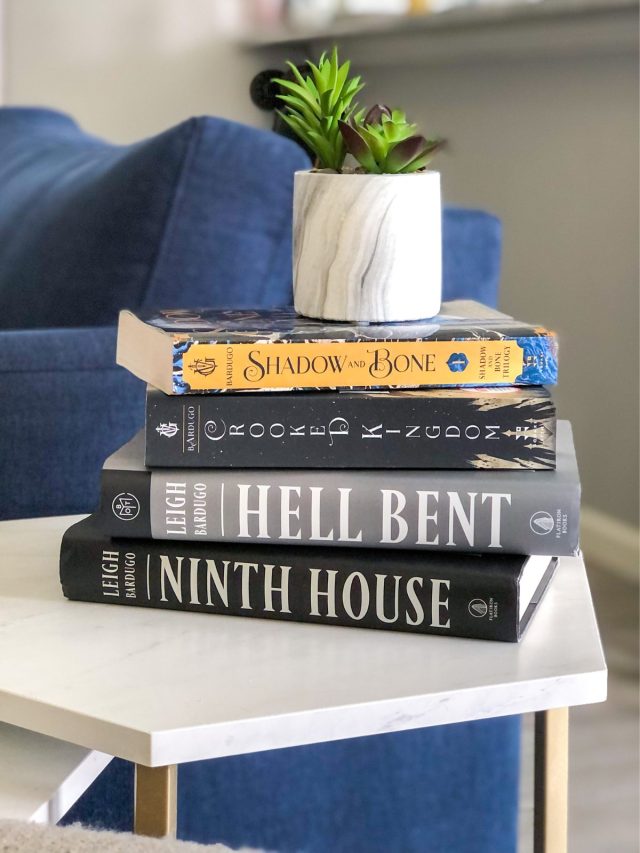
Locate an element on the screen. blue couch is located at coordinates (198, 241).